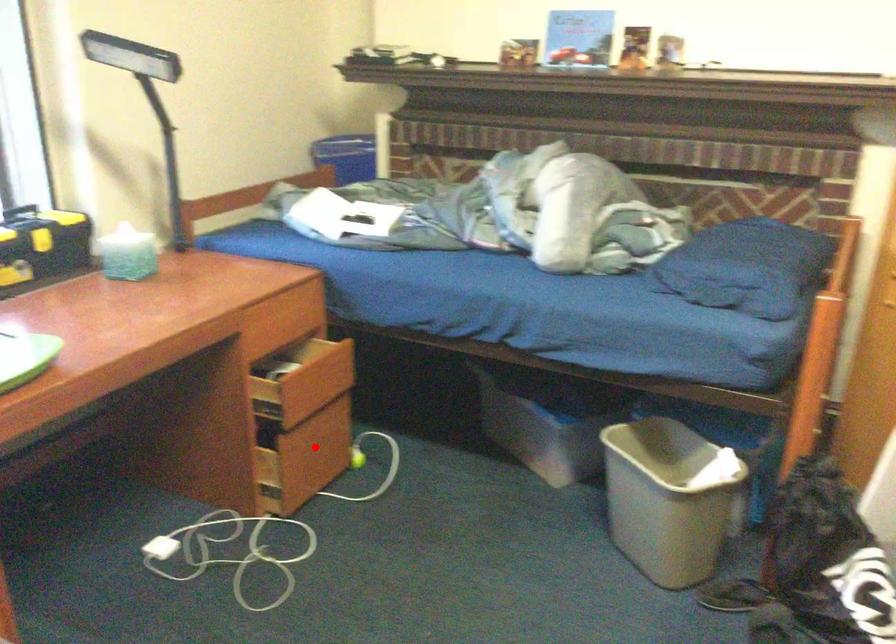
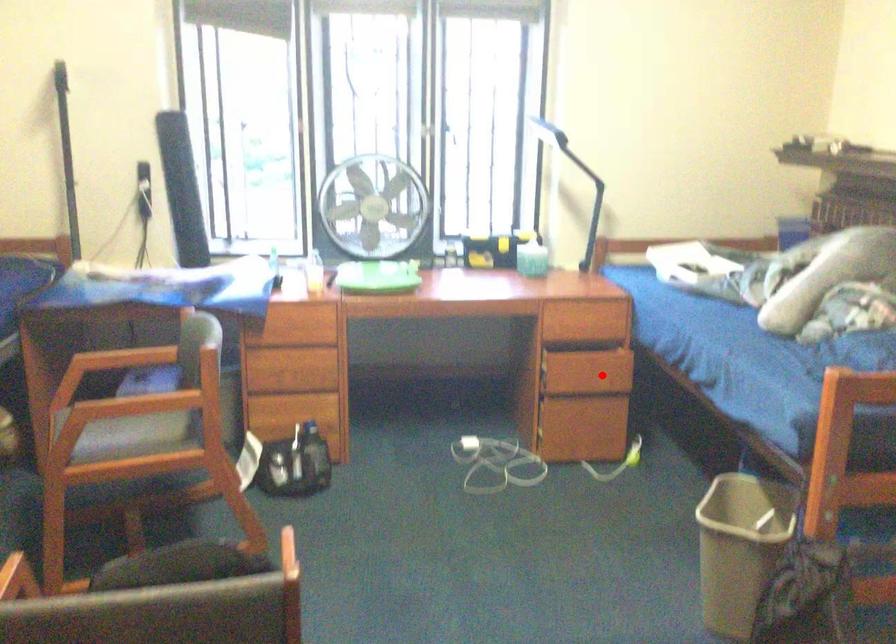
I am providing you with two images of the same scene from different viewpoints. A red point is marked on the first image and another point is marked on the second image. Does the point marked in image1 correspond to the same location as the one in image2?

No